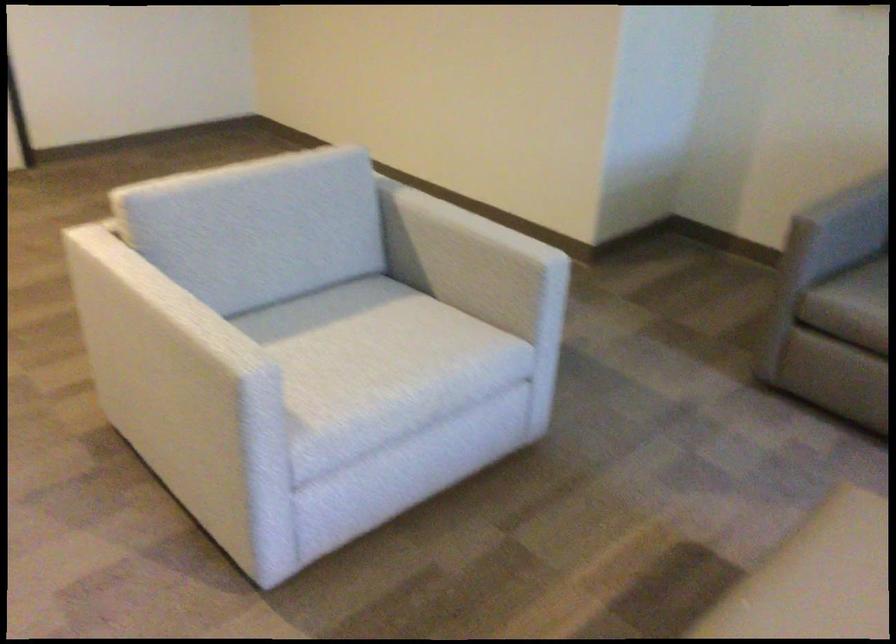
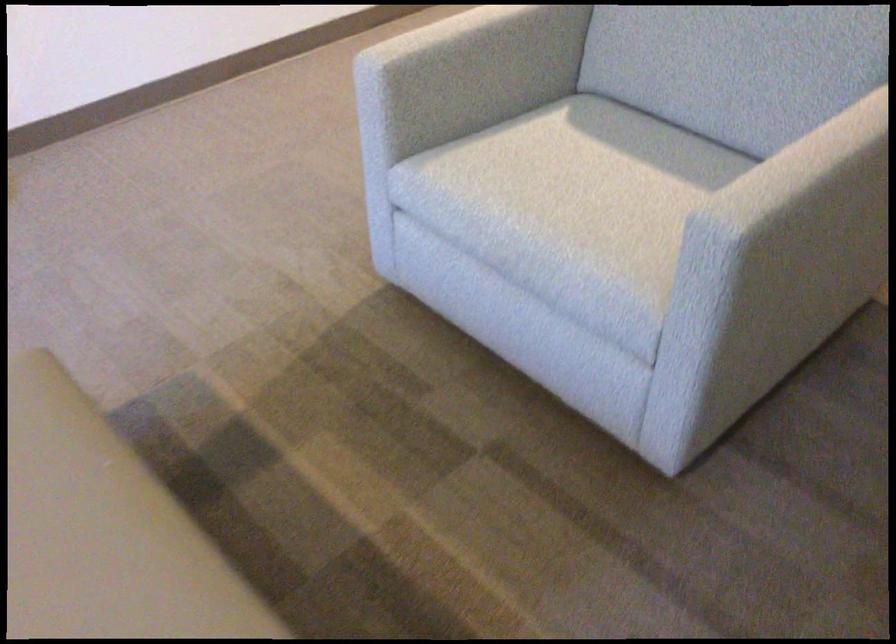
Locate, in the second image, the point that corresponds to the point at 279,415 in the first image.

(385, 120)